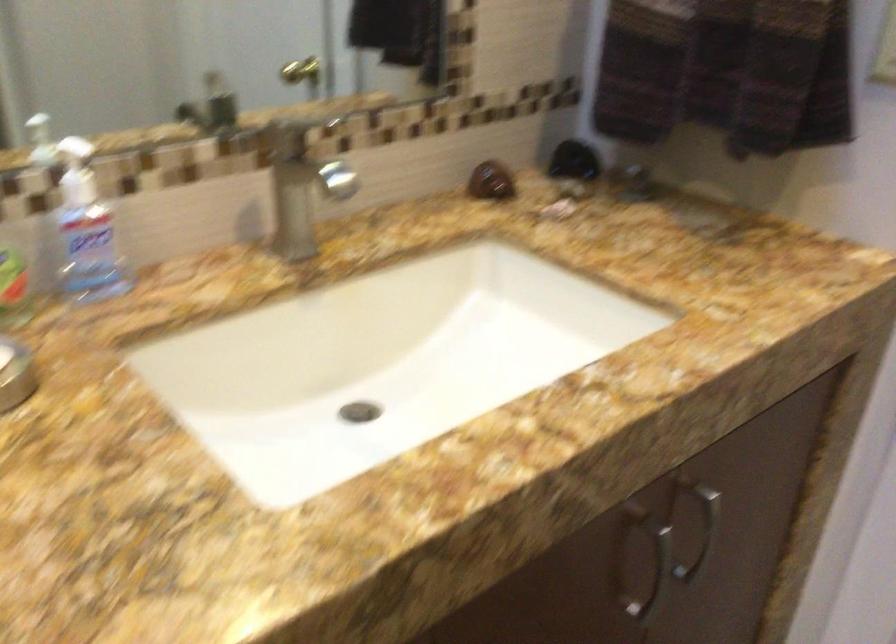
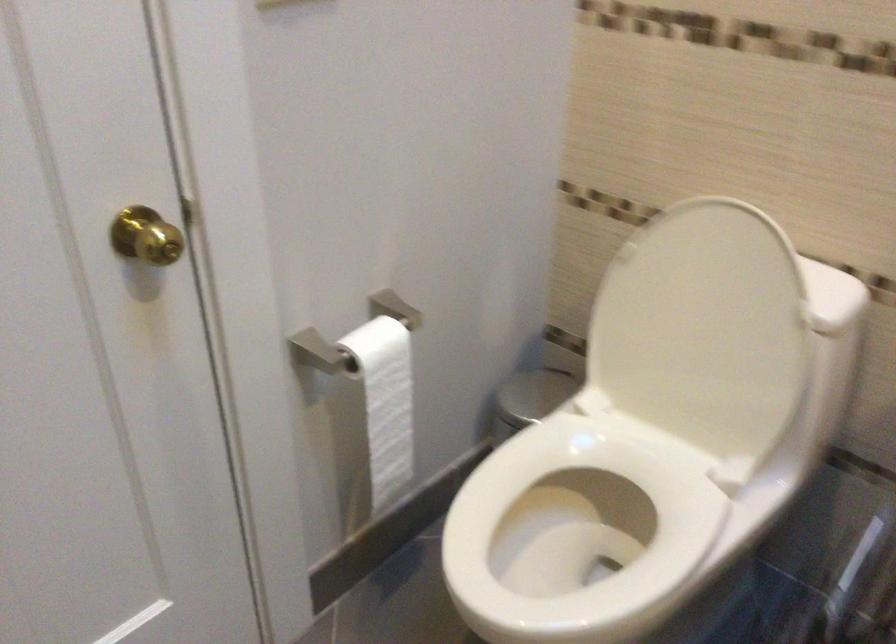
The images are taken continuously from a first-person perspective. In which direction is your viewpoint rotating?

The camera's rotation is toward left-down.